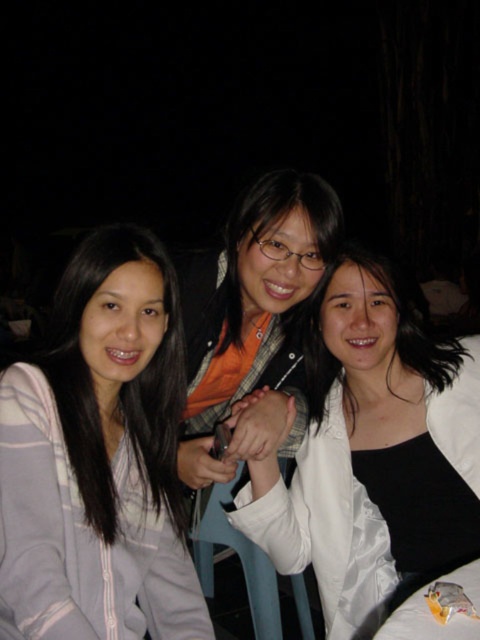
Is light gray cotton jacket at left smaller than white satin blouse at center?

Correct, light gray cotton jacket at left occupies less space than white satin blouse at center.

Does light gray cotton jacket at left appear over white satin blouse at center?

Yes, light gray cotton jacket at left is above white satin blouse at center.

Does point (57, 472) lie in front of point (476, 506)?

Yes, it is.

You are a GUI agent. You are given a task and a screenshot of the screen. Output one action in this format:
    pyautogui.click(x=<x>, y=<y>)
    Task: Click on the light gray cotton jacket at left
    
    Given the screenshot: What is the action you would take?
    pyautogui.click(x=99, y=458)